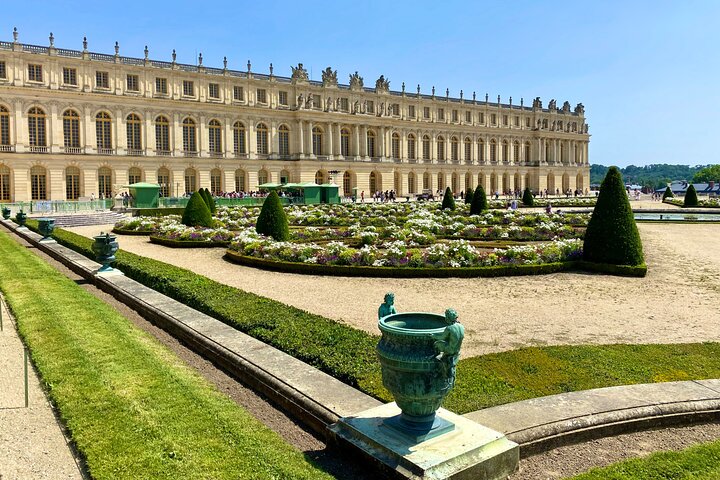
Where is `cup`? The image size is (720, 480). cup is located at coordinates (433, 376).